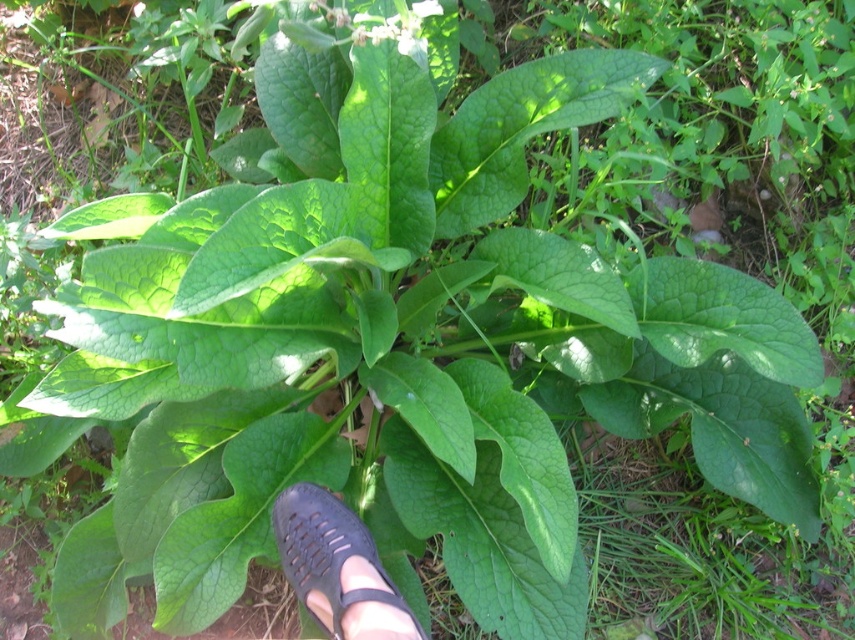
Question: Is black mesh shoe at center wider than green matte flower at upper center?

Choices:
 (A) no
 (B) yes

Answer: (B)

Question: Which of the following is the closest to the observer?

Choices:
 (A) black mesh shoe at center
 (B) green matte flower at upper center

Answer: (A)

Question: Which point is farther from the camera taking this photo?

Choices:
 (A) (361, 33)
 (B) (370, 538)

Answer: (B)

Question: Can you confirm if black mesh shoe at center is positioned to the right of green matte flower at upper center?

Choices:
 (A) no
 (B) yes

Answer: (A)

Question: Where is black mesh shoe at center located in relation to green matte flower at upper center in the image?

Choices:
 (A) below
 (B) above

Answer: (A)